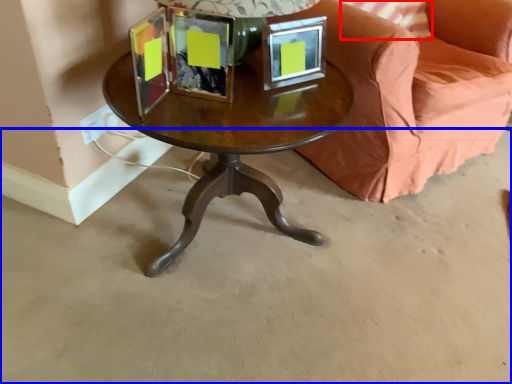
Question: Which object is further to the camera taking this photo, pillow (highlighted by a red box) or concrete (highlighted by a blue box)?

Choices:
 (A) pillow
 (B) concrete

Answer: (A)